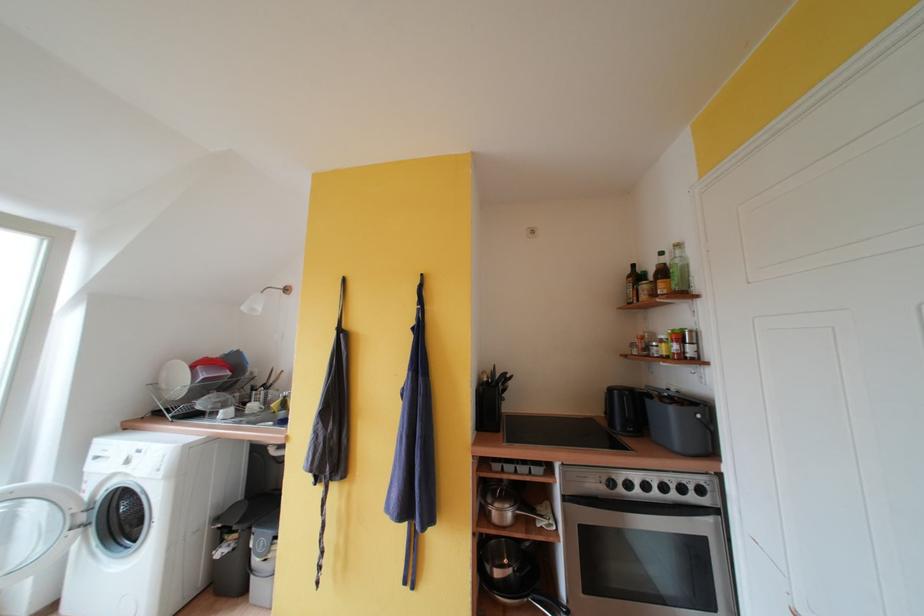
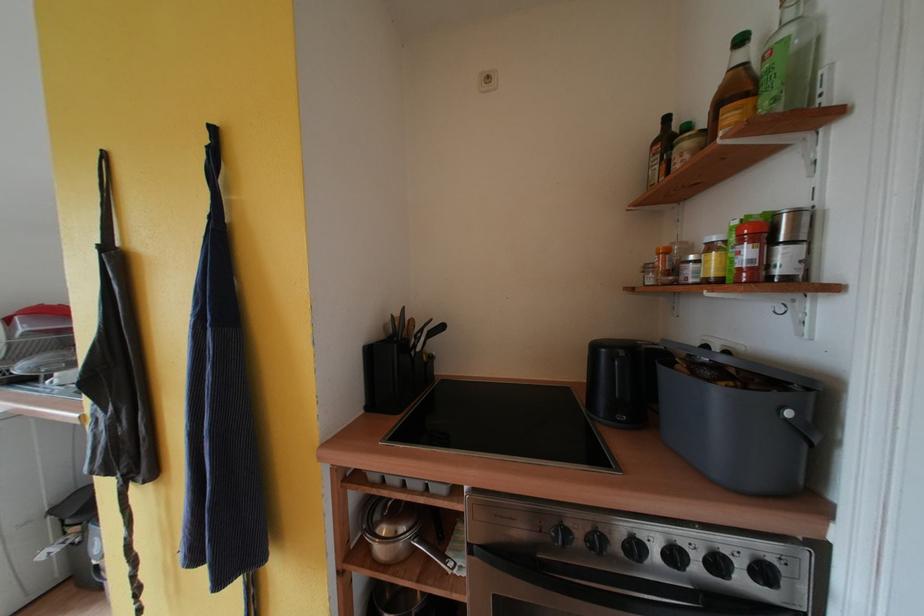
Find the pixel in the second image that matches the point at 670,492 in the first image.

(681, 560)